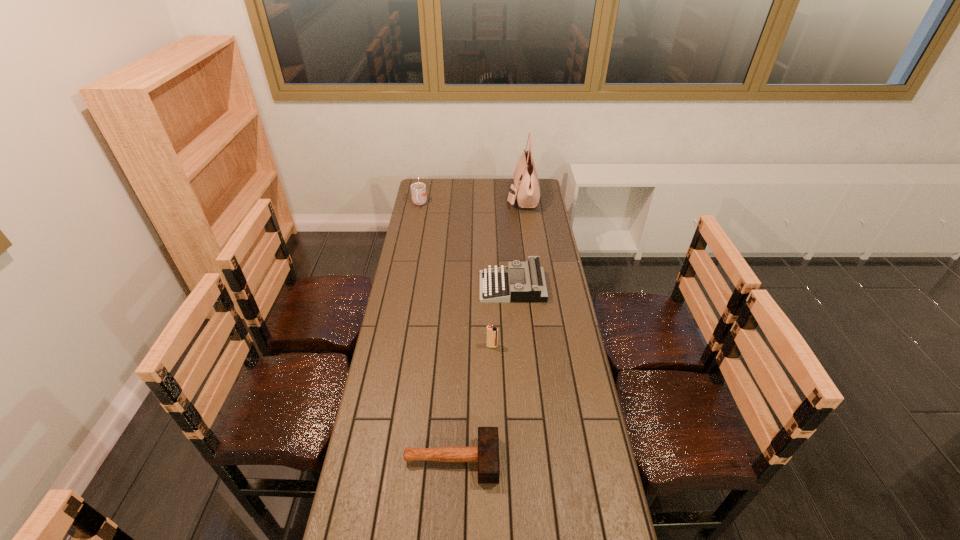
Identify the location of vacant space that's between the leftmost object and the fourth farthest object. (456, 275).

You are a GUI agent. You are given a task and a screenshot of the screen. Output one action in this format:
    pyautogui.click(x=<x>, y=<y>)
    Task: Click on the object that is the closest to the handbag
    The width and height of the screenshot is (960, 540).
    Given the screenshot: What is the action you would take?
    pyautogui.click(x=418, y=190)

At what (x,y) coordinates should I click in order to perform the action: click on the third closest object to the tallest object. Please return your answer as a coordinate pair (x, y). Looking at the image, I should click on (492, 332).

The width and height of the screenshot is (960, 540). I want to click on free location that satisfies the following two spatial constraints: 1. on the side with the handle of the leftmost object; 2. on the left side of the fourth farthest object, so click(x=392, y=346).

Where is `vacant space that satisfies the following two spatial constraints: 1. on the side of the tallest object with the attached pouch; 2. on the side with the handle of the second tallest object`? This screenshot has height=540, width=960. vacant space that satisfies the following two spatial constraints: 1. on the side of the tallest object with the attached pouch; 2. on the side with the handle of the second tallest object is located at coordinates (523, 204).

The height and width of the screenshot is (540, 960). In order to click on vacant space that satisfies the following two spatial constraints: 1. on the side of the tallest object with the attached pouch; 2. on the side with the handle of the cup in this screenshot , I will do `click(523, 204)`.